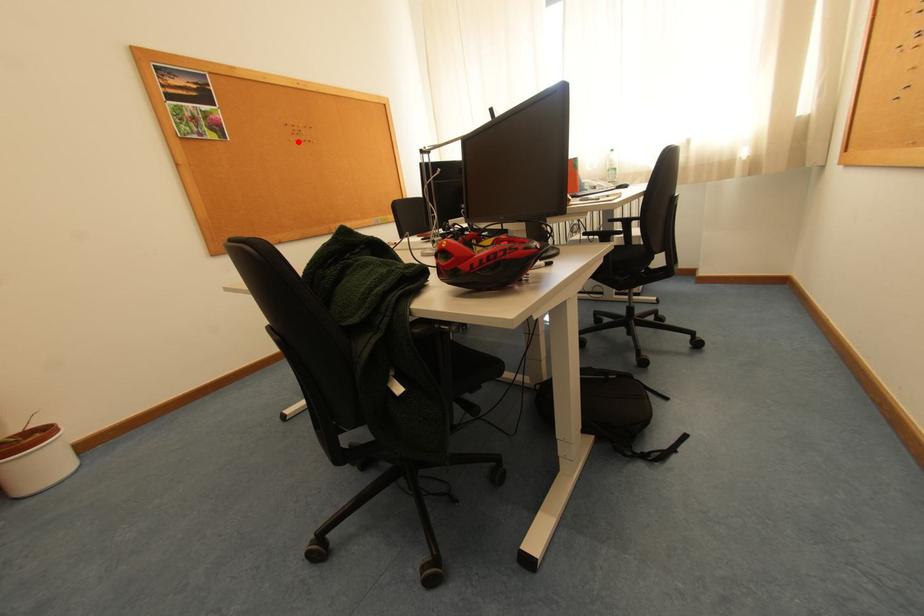
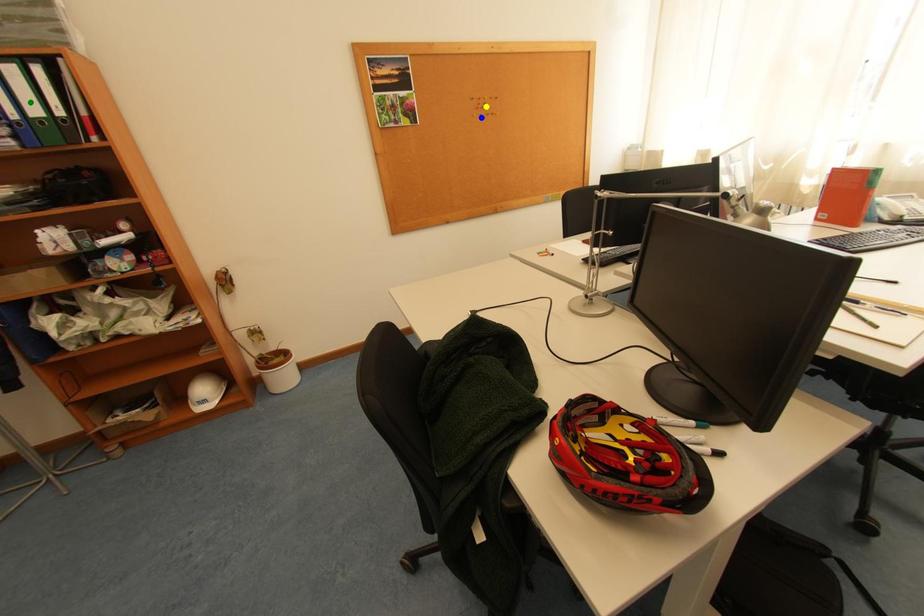
Question: I am providing you with two images of the same scene from different viewpoints. A red point is marked on the first image. You are given multiple points on the second image. Which mark in image 2 goes with the point in image 1?

Choices:
 (A) green point
 (B) blue point
 (C) yellow point

Answer: (B)